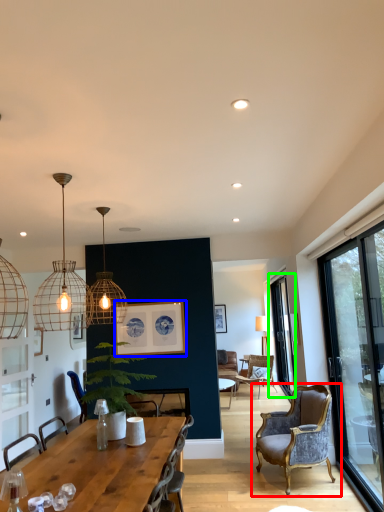
Question: Considering the real-world distances, which object is farthest from chair (highlighted by a red box)? picture frame (highlighted by a blue box) or window (highlighted by a green box)?

Choices:
 (A) picture frame
 (B) window

Answer: (A)